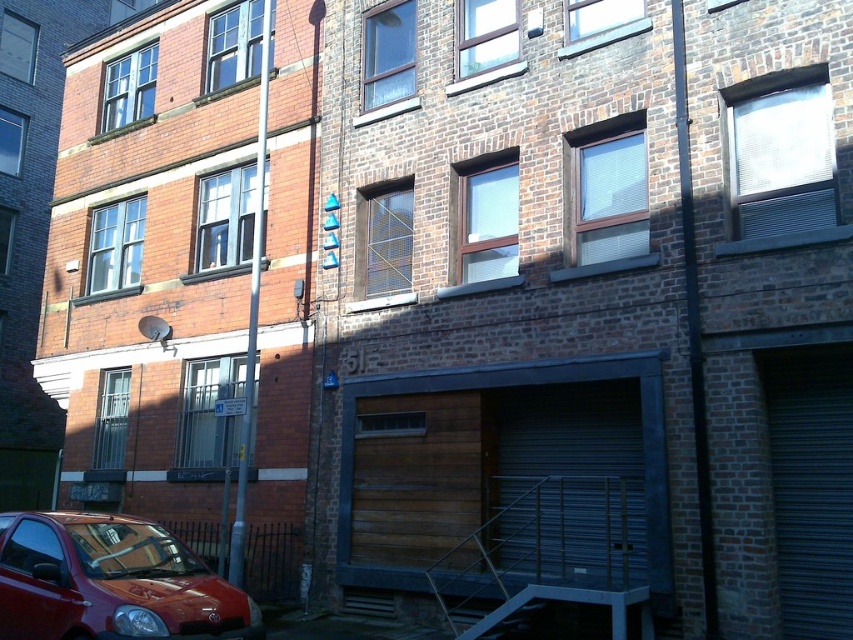
Question: Is metallic gray garage door at lower center below dark gray metallic garage door at lower right?

Choices:
 (A) yes
 (B) no

Answer: (A)

Question: Among these objects, which one is farthest from the camera?

Choices:
 (A) metallic gray garage door at lower center
 (B) shiny red car at lower left
 (C) wooden garage door at lower center

Answer: (A)

Question: Which point is farther to the camera?

Choices:
 (A) wooden garage door at lower center
 (B) shiny red car at lower left
 (C) dark gray metallic garage door at lower right
 (D) metallic gray garage door at lower center

Answer: (D)

Question: Can you confirm if dark gray metallic garage door at lower right is thinner than wooden garage door at lower center?

Choices:
 (A) yes
 (B) no

Answer: (A)

Question: Which object is positioned farthest from the shiny red car at lower left?

Choices:
 (A) dark gray metallic garage door at lower right
 (B) wooden garage door at lower center

Answer: (A)

Question: In this image, where is metallic gray garage door at lower center located relative to dark gray metallic garage door at lower right?

Choices:
 (A) left
 (B) right

Answer: (A)